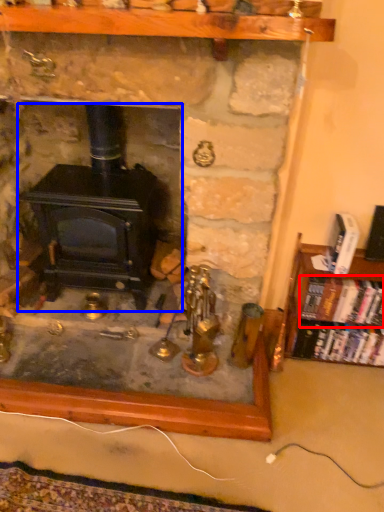
Question: Which object appears closest to the camera in this image, book (highlighted by a red box) or wood burning stove (highlighted by a blue box)?

Choices:
 (A) book
 (B) wood burning stove

Answer: (B)